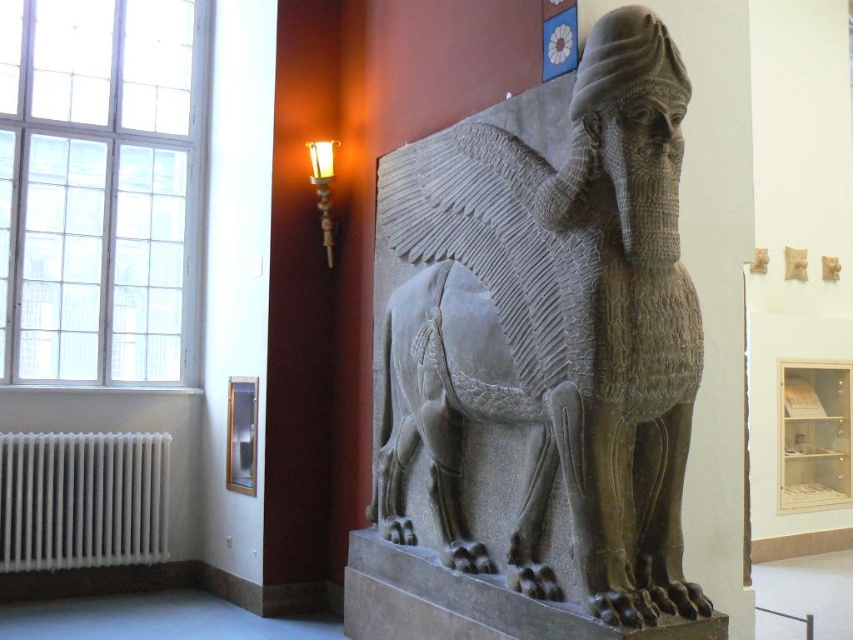
You are an art conservator examining the gray stone winged lion at center. Your task is to locate a specific point on the sculpture for restoration. Where exactly is the point marked as point (544,336) on the gray stone winged lion at center?

The point marked as point (544,336) is located on the gray stone winged lion at center.

You are a museum curator who needs to move a 6.5 feet wide crate through the space between the gray stone winged lion at center and the white metallic radiator at lower left. Can the crate fit through that space?

The distance between the gray stone winged lion at center and the white metallic radiator at lower left is 7.88 feet. Since the crate is 6.5 feet wide, it can fit through the space as the distance is wider than the crate.

You are an art student visiting the museum and want to sketch the gray stone winged lion at center and the white metallic radiator at lower left. Which object should you focus on first if you want to draw the taller one?

The gray stone winged lion at center is much taller than the white metallic radiator at lower left, so you should focus on drawing the gray stone winged lion at center first.